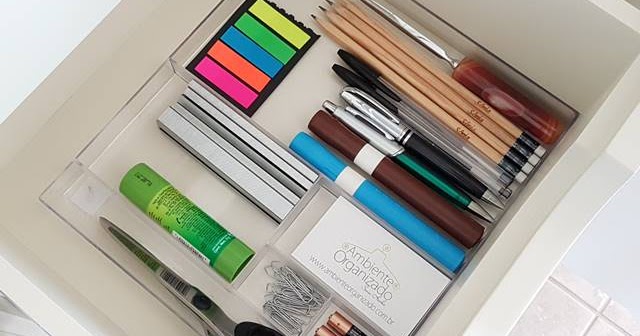
Locate an element on the screen. The height and width of the screenshot is (336, 640). dividers is located at coordinates (198, 260), (255, 267), (320, 309), (272, 321), (294, 265), (290, 213), (338, 192), (273, 143).